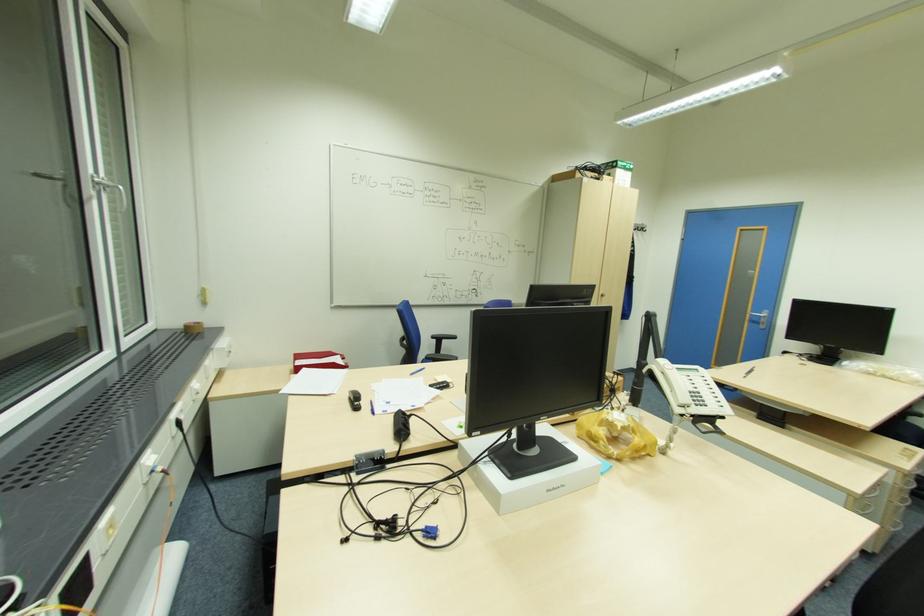
Find the location of a particular element. This screenshot has height=616, width=924. silver window handle is located at coordinates (759, 318).